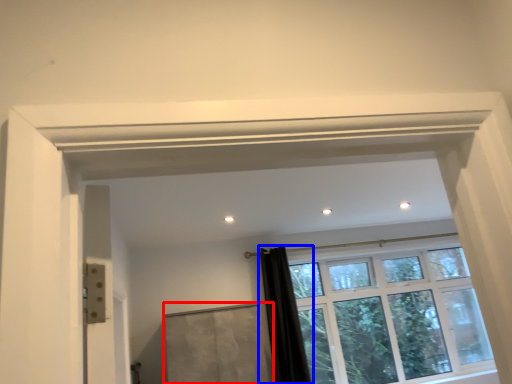
Question: Which point is closer to the camera, screen door (highlighted by a red box) or shower curtain (highlighted by a blue box)?

Choices:
 (A) screen door
 (B) shower curtain

Answer: (A)